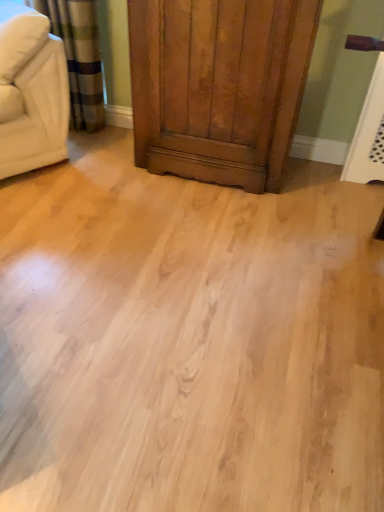
Identify the location of vacant space that is to the left of shiny brown wood dresser at center. (99, 184).